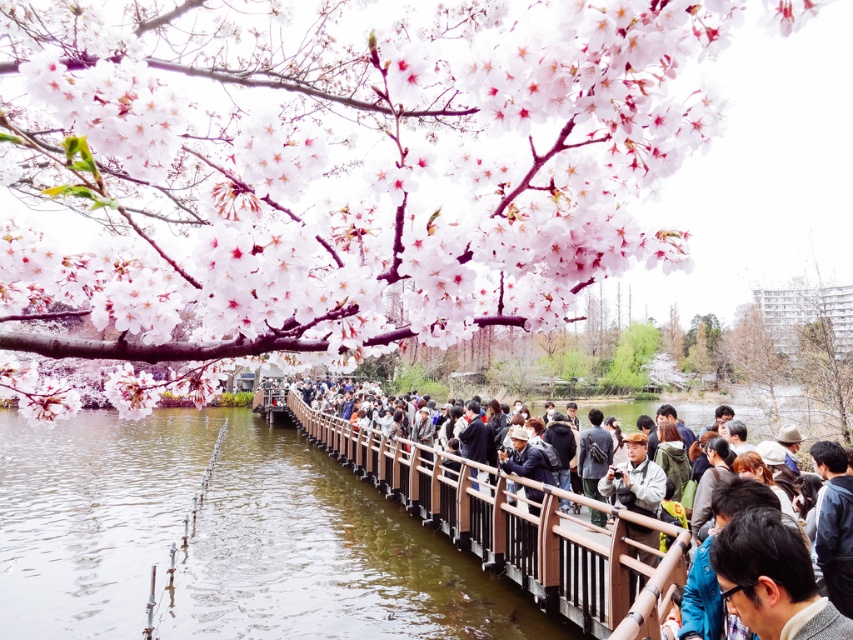
Question: Which of the following is the closest to the observer?

Choices:
 (A) pink blossoms at upper left
 (B) brown wooden rail at center

Answer: (A)

Question: Does pink blossoms at upper left have a lesser width compared to brown wooden rail at center?

Choices:
 (A) no
 (B) yes

Answer: (A)

Question: Can you confirm if pink blossoms at upper left is positioned above brown wooden rail at center?

Choices:
 (A) no
 (B) yes

Answer: (B)

Question: Can you confirm if pink blossoms at upper left is positioned to the left of brown wooden rail at center?

Choices:
 (A) no
 (B) yes

Answer: (B)

Question: Which object is farther from the camera taking this photo?

Choices:
 (A) brown wooden rail at center
 (B) pink blossoms at upper left

Answer: (A)